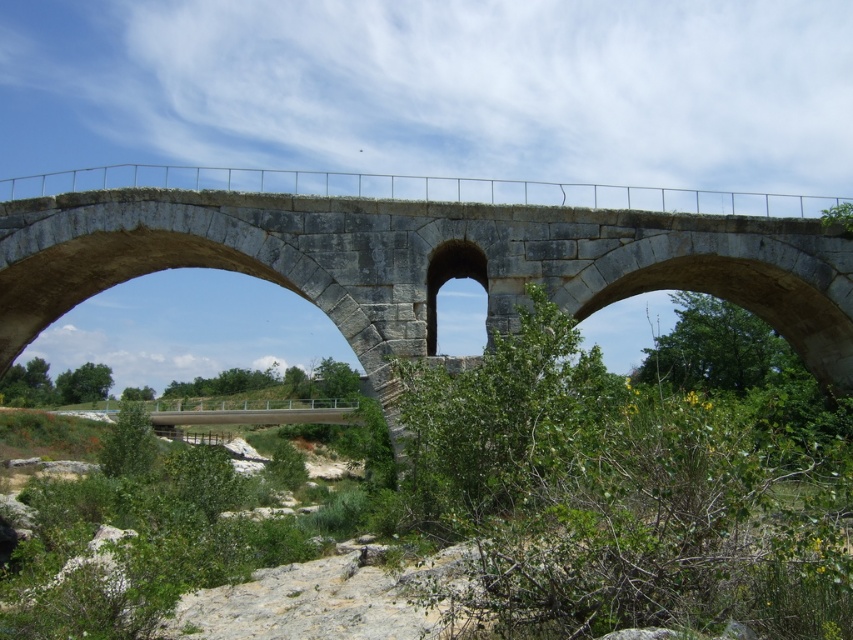
Question: Which object appears closest to the camera in this image?

Choices:
 (A) gray stone bridge at center
 (B) green leafy bush at center

Answer: (B)

Question: Does gray stone bridge at center have a smaller size compared to gray stone arch at center?

Choices:
 (A) yes
 (B) no

Answer: (B)

Question: In this image, where is gray stone bridge at center located relative to gray stone arch at center?

Choices:
 (A) below
 (B) above

Answer: (B)

Question: Considering the real-world distances, which object is farthest from the gray stone bridge at center?

Choices:
 (A) gray stone arch at center
 (B) green leafy bush at center

Answer: (B)

Question: In this image, where is green leafy bush at center located relative to gray stone arch at center?

Choices:
 (A) below
 (B) above

Answer: (A)

Question: Which point appears closest to the camera in this image?

Choices:
 (A) (432, 289)
 (B) (405, 493)
 (C) (399, 179)

Answer: (B)